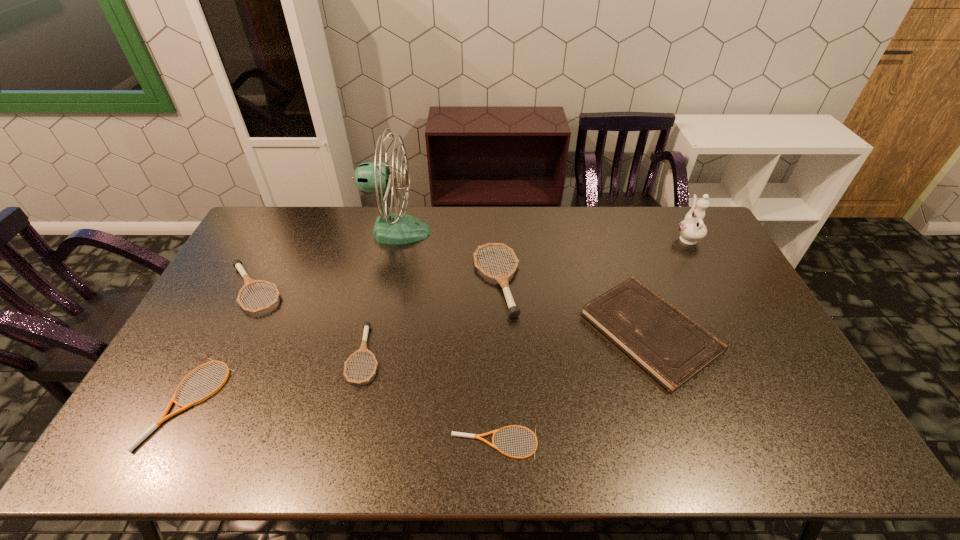
This screenshot has height=540, width=960. In order to click on fan in this screenshot , I will do coord(378,178).

Find the location of `the tallest object`. the tallest object is located at coordinates (378, 178).

Where is `the seventh shortest object`? Image resolution: width=960 pixels, height=540 pixels. the seventh shortest object is located at coordinates (692, 228).

What are the coordinates of `the rightmost object` in the screenshot? It's located at (692, 228).

Image resolution: width=960 pixels, height=540 pixels. I want to click on the biggest gray tennis racket, so click(x=503, y=279).

This screenshot has height=540, width=960. Find the location of `the rightmost gray tennis racket`. the rightmost gray tennis racket is located at coordinates (503, 279).

Locate an element on the screen. This screenshot has width=960, height=540. paperback book is located at coordinates (670, 346).

Where is `the leftmost gray tennis racket`? the leftmost gray tennis racket is located at coordinates (237, 264).

I want to click on the second smallest gray tennis racket, so click(x=237, y=264).

Identify the location of the third shortest object. Image resolution: width=960 pixels, height=540 pixels. (363, 348).